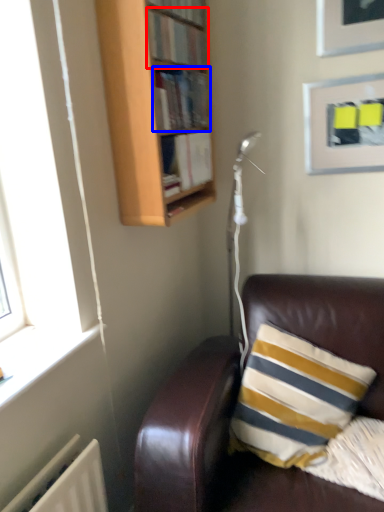
Question: Which of the following is the farthest to the observer, book (highlighted by a red box) or book (highlighted by a blue box)?

Choices:
 (A) book
 (B) book

Answer: (B)